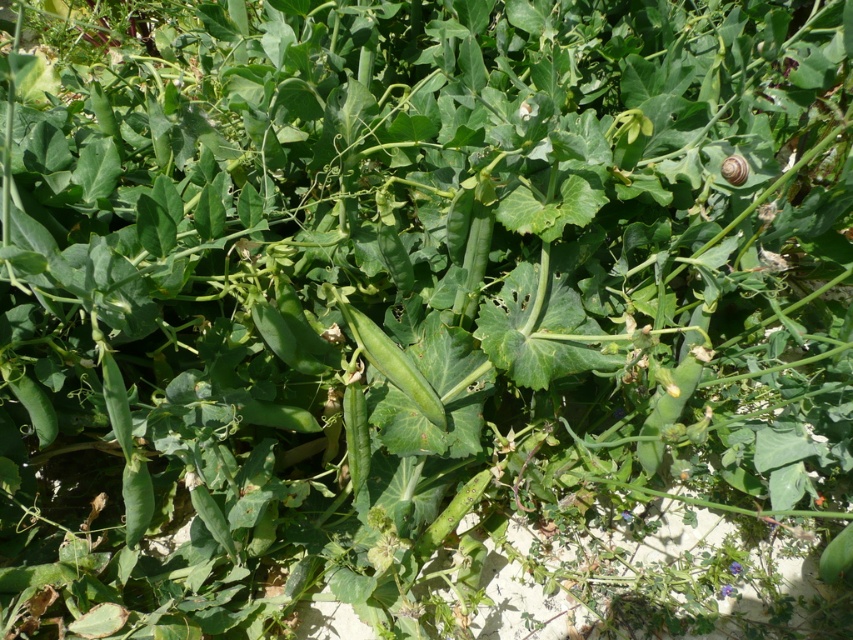
You are a gardener who wants to harvest the green matte pod at center but there is a satin brown snail at upper right nearby. Which one is higher up in the plant so you can reach the pod first?

The green matte pod at center is much taller than the satin brown snail at upper right, so you can reach the green matte pod at center first.

You are a gardener who wants to check the pea pods for ripeness. You see the green matte pod at center and the satin brown snail at upper right. Which object is closer to the left side of the image?

The green matte pod at center is to the left of the satin brown snail at upper right, so the green matte pod at center is closer to the left side of the image.

You are a gardener who wants to locate the green matte pod at center. What are its coordinates?

The green matte pod at center is located at coordinates point (x=393, y=364).